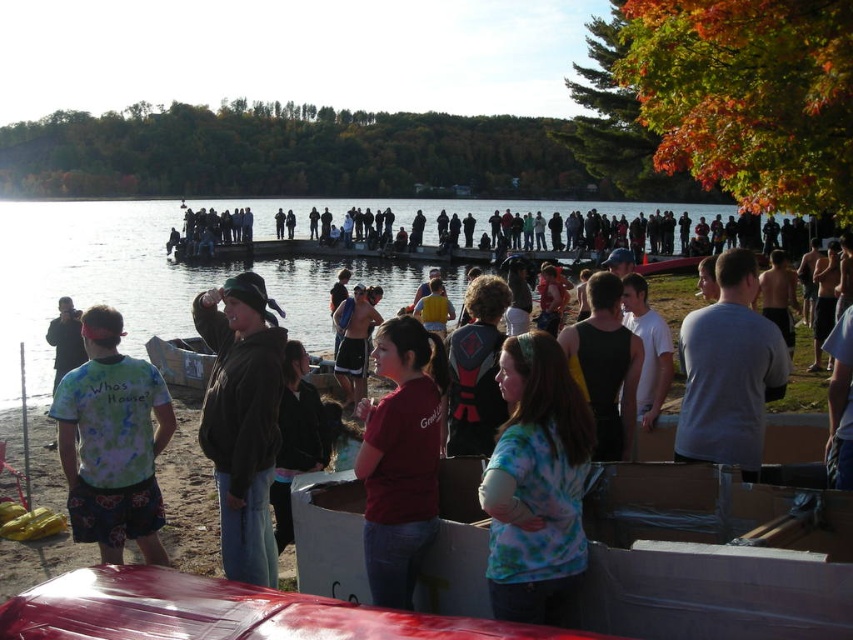
Question: Which point is farther to the camera?

Choices:
 (A) matte black shorts at center
 (B) tie-dye fabric shirt at left
 (C) black matte tank top at center
 (D) dark gray hoodie at center

Answer: (A)

Question: Is dark green fleece jacket at center wider than matte black people at center?

Choices:
 (A) no
 (B) yes

Answer: (A)

Question: Does matte red shirt at center have a larger size compared to matte black shorts at center?

Choices:
 (A) yes
 (B) no

Answer: (B)

Question: Which of the following is the farthest from the observer?

Choices:
 (A) (339, 372)
 (B) (840, 349)
 (C) (183, 340)

Answer: (C)

Question: Is gray cotton shirt at right smaller than matte black backpack at center?

Choices:
 (A) yes
 (B) no

Answer: (A)

Question: Among these points, which one is nearest to the camera?

Choices:
 (A) (265, 486)
 (B) (357, 304)

Answer: (A)